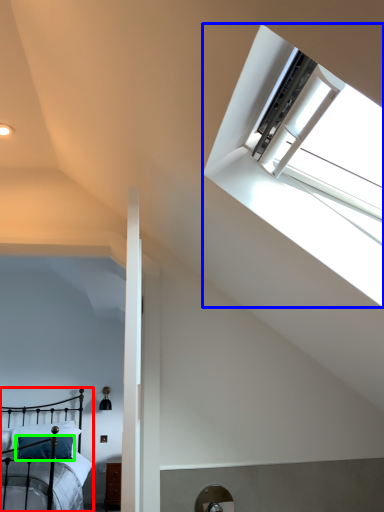
Question: Based on their relative distances, which object is farther from bed (highlighted by a red box)? Choose from window (highlighted by a blue box) and pillow (highlighted by a green box).

Choices:
 (A) window
 (B) pillow

Answer: (A)